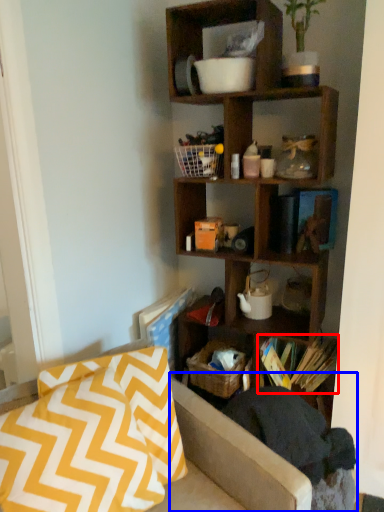
Question: Which of the following is the farthest to the observer, book (highlighted by a red box) or swivel chair (highlighted by a blue box)?

Choices:
 (A) book
 (B) swivel chair

Answer: (A)